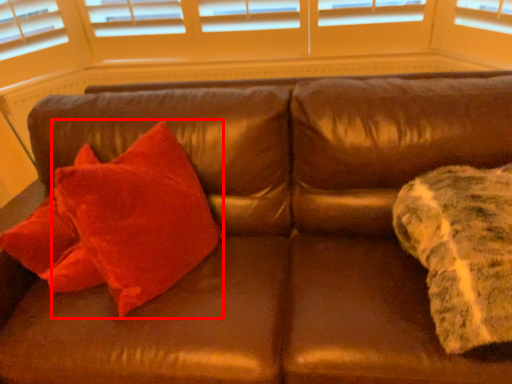
Question: From the image's perspective, where is throw pillow (annotated by the red box) located in relation to blanket in the image?

Choices:
 (A) above
 (B) below

Answer: (A)